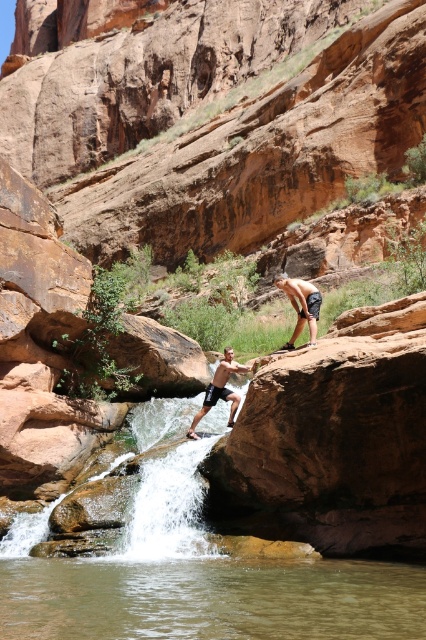
Please provide the 2D coordinates of the clear water at center in the image. The coordinates should be in the format of a tuple with two decimal numbers separated by a comma.

The 2D coordinates of the clear water at center are at point [210,600].

You are standing at the edge of the canyon pool and want to jump into the water. There are two points marked in the image. Which point, point (310, 342) or point (227, 365), is closer to you?

Point (310, 342) is closer to the camera than point (227, 365), so it is closer to you.